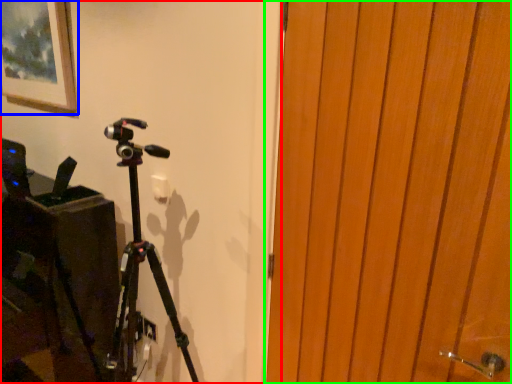
Question: Which object is the closest to the backdrop (highlighted by a red box)? Choose among these: picture frame (highlighted by a blue box) or door (highlighted by a green box).

Choices:
 (A) picture frame
 (B) door

Answer: (B)